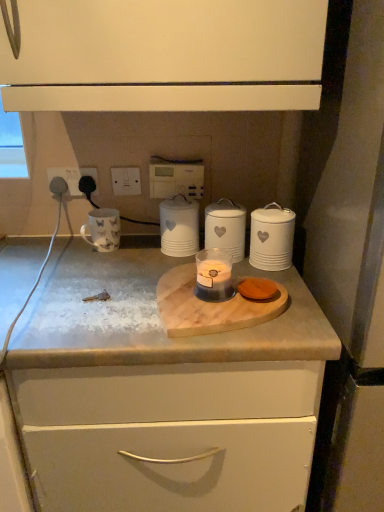
At what (x,y) coordinates should I click in order to perform the action: click on free space to the left of white matte canister at center, which is the first home appliance in left-to-right order. Please return your answer as a coordinate pair (x, y). The height and width of the screenshot is (512, 384). Looking at the image, I should click on (126, 257).